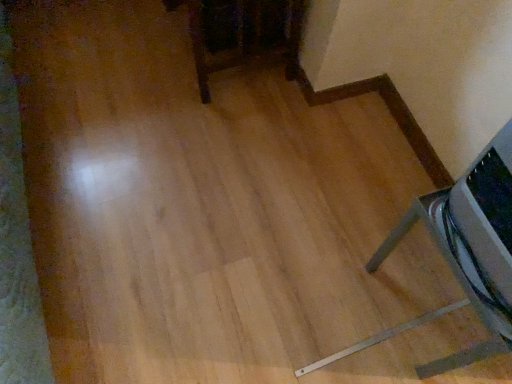
Question: Is point (216, 49) positioned closer to the camera than point (457, 188)?

Choices:
 (A) closer
 (B) farther

Answer: (B)

Question: From the image's perspective, is dark wood table at upper center, which is the second furniture in bottom-to-top order, positioned above or below metallic silver speaker at lower right, arranged as the first furniture when viewed from the right?

Choices:
 (A) below
 (B) above

Answer: (B)

Question: In terms of width, does dark wood table at upper center, which is the second furniture in bottom-to-top order, look wider or thinner when compared to metallic silver speaker at lower right, the 1th furniture positioned from the bottom?

Choices:
 (A) thin
 (B) wide

Answer: (B)

Question: Is point (488, 286) closer or farther from the camera than point (200, 41)?

Choices:
 (A) closer
 (B) farther

Answer: (A)

Question: Considering the positions of metallic silver speaker at lower right, the 1th furniture positioned from the bottom, and dark wood table at upper center, which is the second furniture in bottom-to-top order, in the image, is metallic silver speaker at lower right, the 1th furniture positioned from the bottom, taller or shorter than dark wood table at upper center, which is the second furniture in bottom-to-top order,?

Choices:
 (A) tall
 (B) short

Answer: (B)

Question: Relative to dark wood table at upper center, which is the second furniture in bottom-to-top order, is metallic silver speaker at lower right, positioned as the 2th furniture in top-to-bottom order, in front or behind?

Choices:
 (A) behind
 (B) front

Answer: (B)

Question: Is metallic silver speaker at lower right, placed as the second furniture when sorted from left to right, bigger or smaller than dark wood table at upper center, arranged as the second furniture when viewed from the right?

Choices:
 (A) big
 (B) small

Answer: (B)